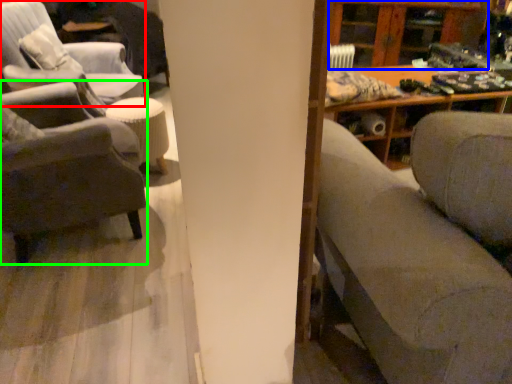
Question: Based on their relative distances, which object is nearer to chair (highlighted by a red box)? Choose from shelf (highlighted by a blue box) and chair (highlighted by a green box).

Choices:
 (A) shelf
 (B) chair

Answer: (B)